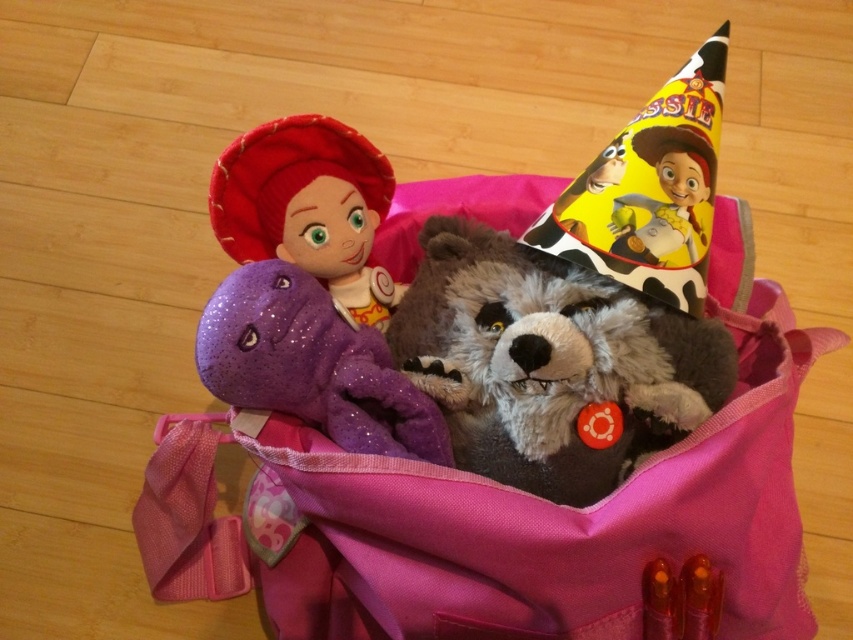
Question: Can you confirm if sparkly purple dinosaur at center is positioned to the right of matte fabric doll at upper left?

Choices:
 (A) no
 (B) yes

Answer: (B)

Question: Which is nearer to the yellow paper party hat at upper right?

Choices:
 (A) matte fabric doll at upper left
 (B) sparkly purple dinosaur at center

Answer: (B)

Question: Which object is closer to the camera taking this photo?

Choices:
 (A) matte fabric doll at upper left
 (B) yellow paper party hat at upper right
 (C) sparkly purple dinosaur at center

Answer: (C)

Question: Can you confirm if sparkly purple dinosaur at center is wider than yellow paper party hat at upper right?

Choices:
 (A) yes
 (B) no

Answer: (A)

Question: Among these points, which one is farthest from the camera?

Choices:
 (A) 671,132
 (B) 393,388
 (C) 231,202

Answer: (C)

Question: Is fluffy brown stuffed bear at center closer to the viewer compared to yellow paper party hat at upper right?

Choices:
 (A) yes
 (B) no

Answer: (A)